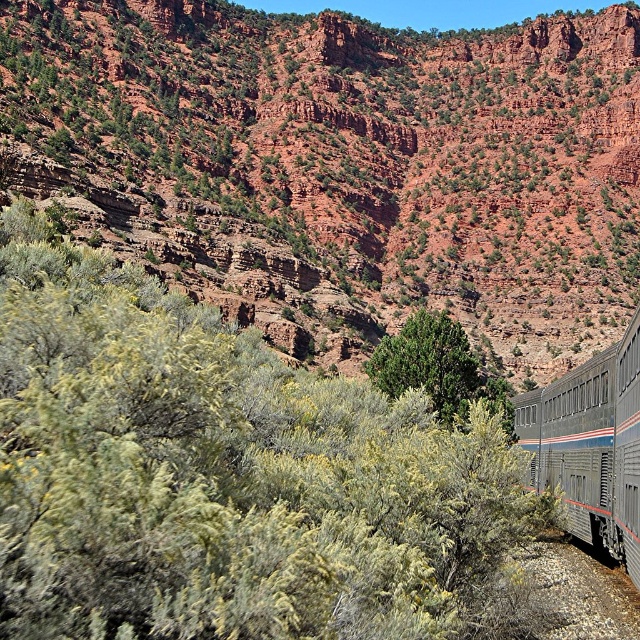
Question: Based on their relative distances, which object is nearer to the metallic silver train at right?

Choices:
 (A) green matte tree at center
 (B) rustic rock formation at upper center
 (C) green leafy bush at center

Answer: (A)

Question: Is the position of rustic rock formation at upper center less distant than that of metallic silver train at right?

Choices:
 (A) yes
 (B) no

Answer: (B)

Question: Which point is farther from the camera taking this photo?

Choices:
 (A) (179, 625)
 (B) (461, 349)
 (C) (564, 483)

Answer: (B)

Question: Considering the relative positions of rustic rock formation at upper center and green leafy bush at center in the image provided, where is rustic rock formation at upper center located with respect to green leafy bush at center?

Choices:
 (A) left
 (B) right

Answer: (B)

Question: Is rustic rock formation at upper center thinner than green leafy bush at center?

Choices:
 (A) yes
 (B) no

Answer: (B)

Question: Which object is farther from the camera taking this photo?

Choices:
 (A) green leafy bush at center
 (B) rustic rock formation at upper center
 (C) green matte tree at center
 (D) metallic silver train at right

Answer: (B)